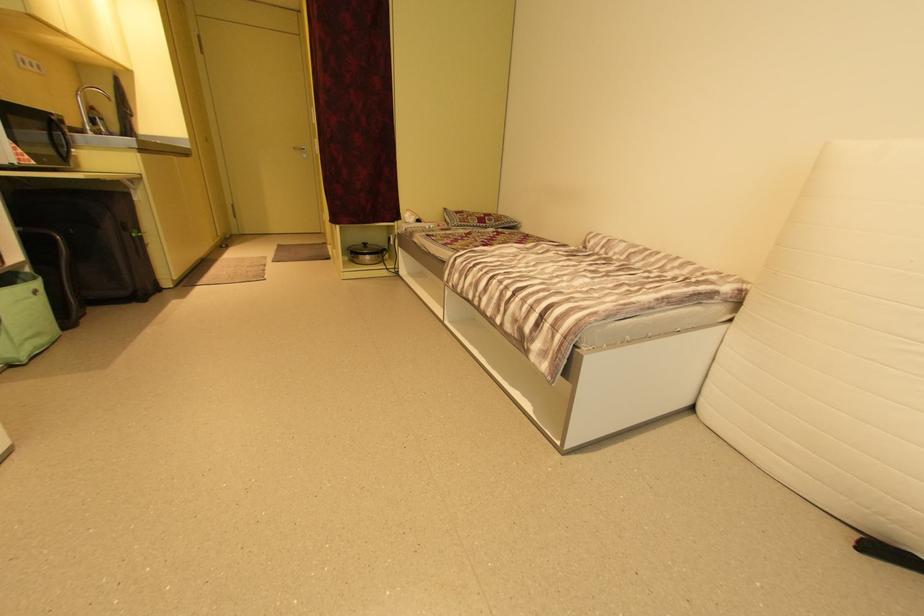
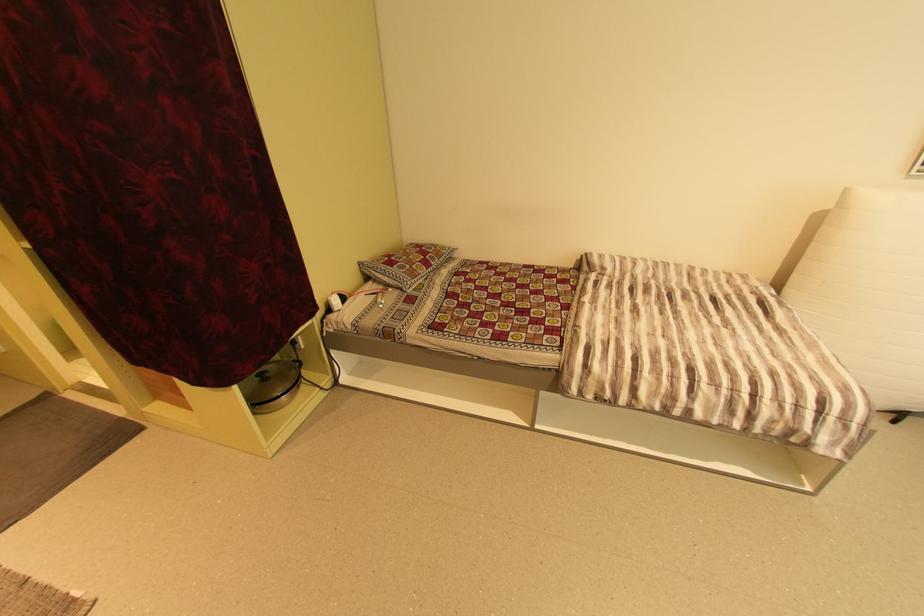
Where in the second image is the point corresponding to (x=412, y=224) from the first image?

(335, 310)